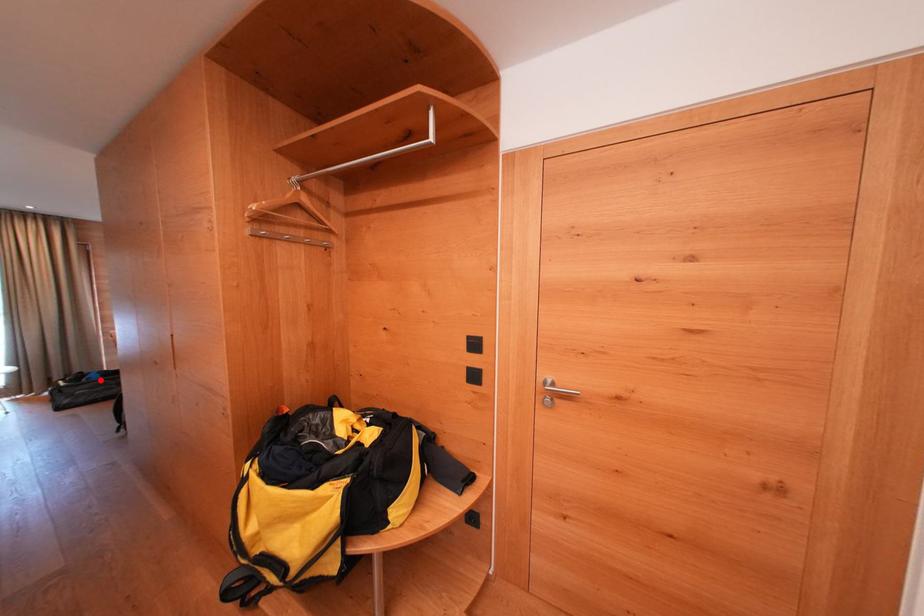
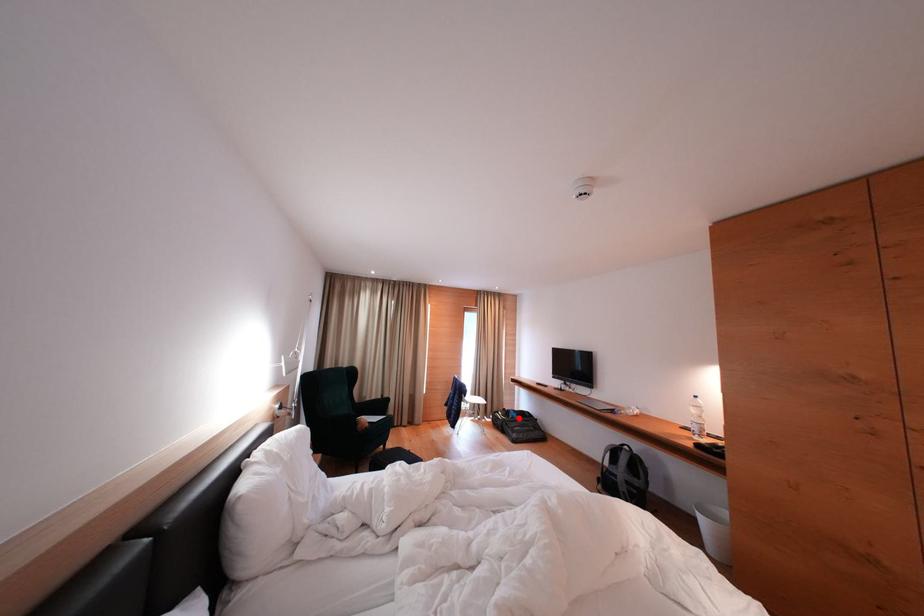
I am providing you with two images of the same scene from different viewpoints. A red point is marked on the first image and another point is marked on the second image. Do the highlighted points in image1 and image2 indicate the same real-world spot?

Yes